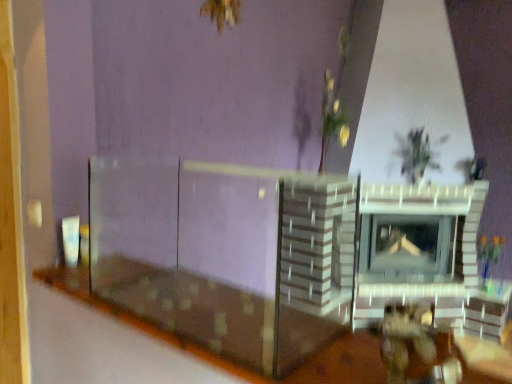
Question: From a real-world perspective, relative to green leafy plant at upper right, is wooden table at lower center vertically above or below?

Choices:
 (A) below
 (B) above

Answer: (A)

Question: Considering the relative positions of wooden table at lower center and green leafy plant at upper right in the image provided, is wooden table at lower center to the left or to the right of green leafy plant at upper right?

Choices:
 (A) right
 (B) left

Answer: (B)

Question: In terms of size, does wooden table at lower center appear bigger or smaller than green leafy plant at upper right?

Choices:
 (A) small
 (B) big

Answer: (B)

Question: Considering the relative positions of green leafy plant at upper right and wooden table at lower center in the image provided, is green leafy plant at upper right to the left or to the right of wooden table at lower center?

Choices:
 (A) left
 (B) right

Answer: (B)

Question: Would you say green leafy plant at upper right is inside or outside wooden table at lower center?

Choices:
 (A) inside
 (B) outside

Answer: (B)

Question: From a real-world perspective, is green leafy plant at upper right physically located above or below wooden table at lower center?

Choices:
 (A) above
 (B) below

Answer: (A)

Question: Is point (459, 162) closer or farther from the camera than point (243, 379)?

Choices:
 (A) closer
 (B) farther

Answer: (B)